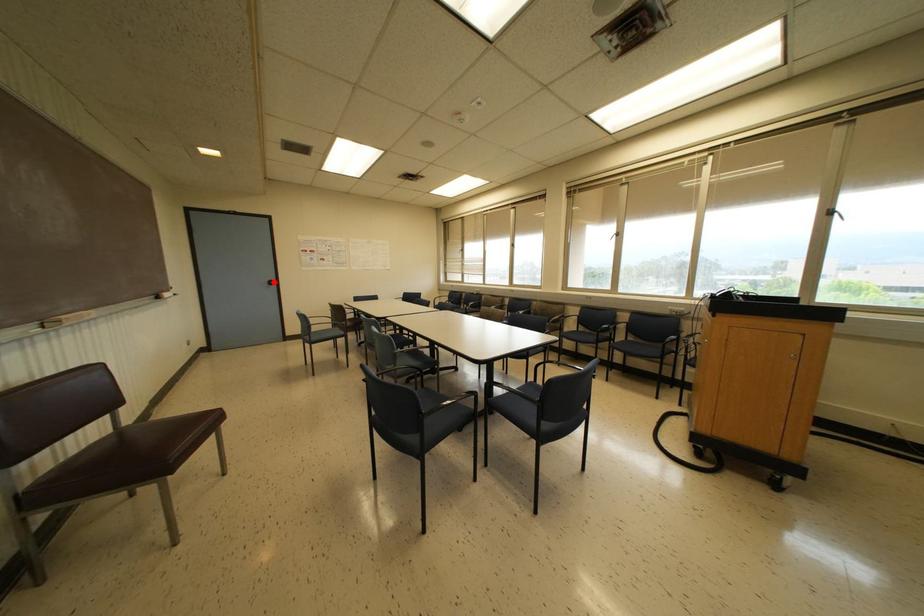
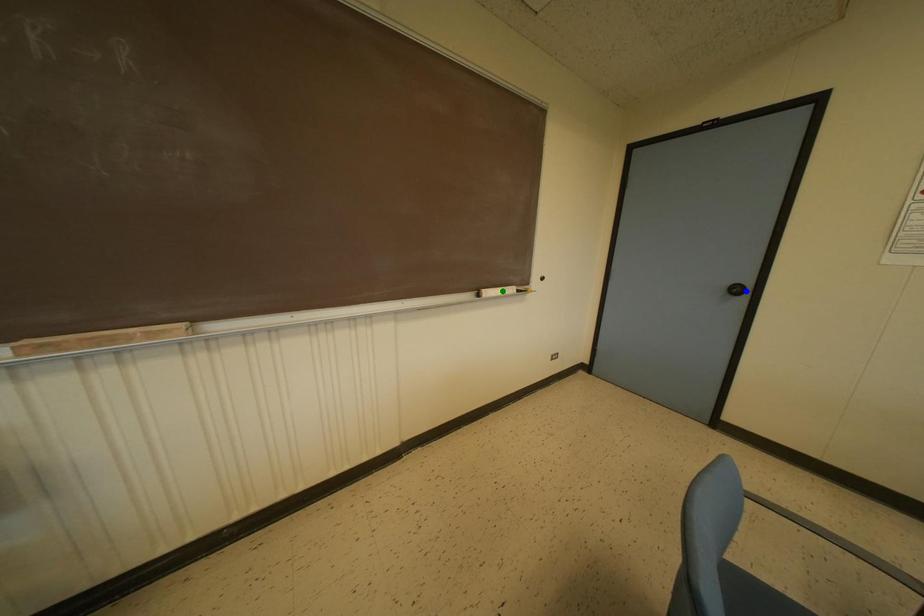
Question: I am providing you with two images of the same scene from different viewpoints. A red point is marked on the first image. You are given multiple points on the second image. Which spot in image 2 lines up with the point in image 1?

Choices:
 (A) yellow point
 (B) green point
 (C) blue point

Answer: (C)